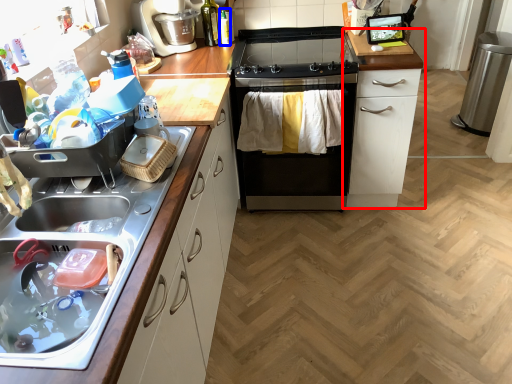
Question: Which object appears closest to the camera in this image, cabinetry (highlighted by a red box) or bottle (highlighted by a blue box)?

Choices:
 (A) cabinetry
 (B) bottle

Answer: (A)